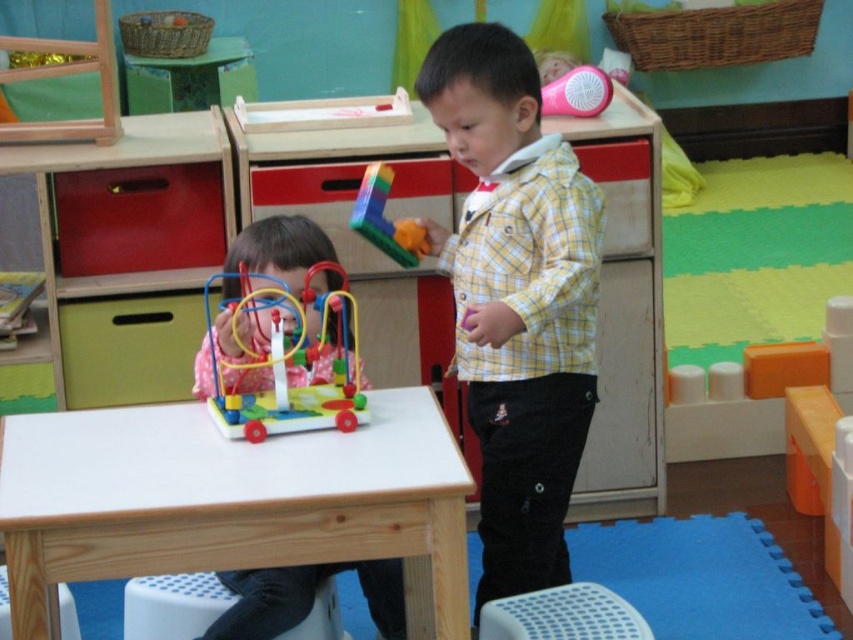
Can you confirm if matte pink dress at left is positioned to the right of white plastic stool at lower center?

Indeed, matte pink dress at left is positioned on the right side of white plastic stool at lower center.

Can you confirm if matte pink dress at left is thinner than white plastic stool at lower center?

Correct, matte pink dress at left's width is less than white plastic stool at lower center's.

Between point (305, 611) and point (345, 632), which one is positioned behind?

The point (345, 632) is behind.

The width and height of the screenshot is (853, 640). I want to click on matte pink dress at left, so click(276, 250).

Is white wooden table at center above rubberized plastic toy at center?

Incorrect, white wooden table at center is not positioned above rubberized plastic toy at center.

Is point (334, 481) farther from camera compared to point (424, 252)?

No, it is in front of (424, 252).

Describe the element at coordinates (231, 502) in the screenshot. I see `white wooden table at center` at that location.

At what (x,y) coordinates should I click in order to perform the action: click on white wooden table at center. Please return your answer as a coordinate pair (x, y). Looking at the image, I should click on (231, 502).

What do you see at coordinates (515, 298) in the screenshot? Image resolution: width=853 pixels, height=640 pixels. I see `yellow checkered shirt at center` at bounding box center [515, 298].

Who is positioned more to the right, yellow checkered shirt at center or matte pink dress at left?

Positioned to the right is yellow checkered shirt at center.

Is point (521, 566) more distant than point (318, 369)?

Yes.

I want to click on yellow checkered shirt at center, so click(x=515, y=298).